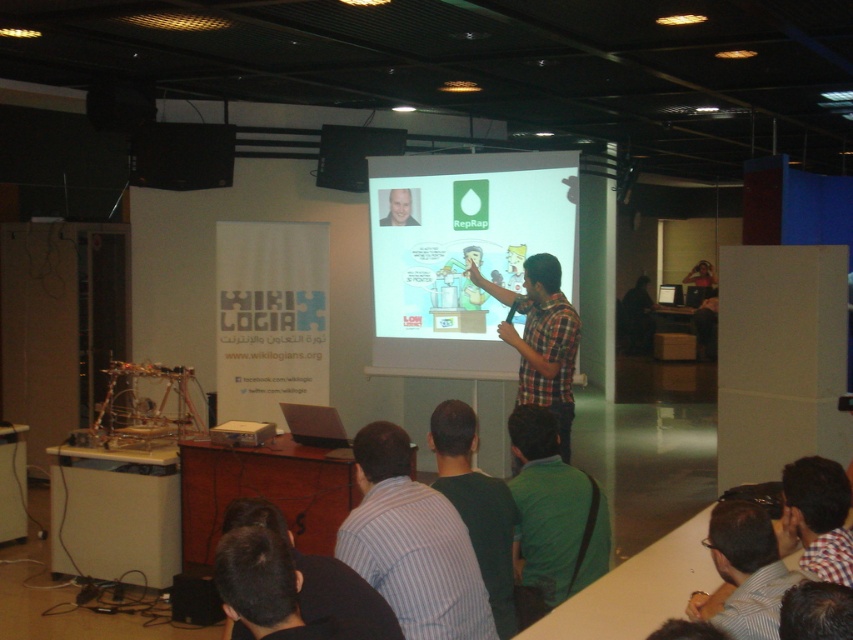
You are an attendee at the presentation. You notice the presenter is standing in front of the white matte projection screen at center and wearing the light blue shirt at center. Which object is bigger in size?

The white matte projection screen at center is larger in size than the light blue shirt at center.

You are standing in the conference room and want to move closer to the point marked at coordinates (x=834, y=516). If you can move 3 meters forward, will you reach the point?

The point marked at coordinates (x=834, y=516) is 2.49 meters away from you. Since you can move 3 meters forward, you will reach the point and have some distance to spare.

You are organizing a small event and need to ensure that the checkered fabric shirt at lower right and the matte black projector at upper center are visible to all attendees. Considering their sizes, which object might require a more strategic placement to ensure visibility?

The checkered fabric shirt at lower right has a smaller width compared to the matte black projector at upper center, so it might require a more strategic placement to ensure visibility.